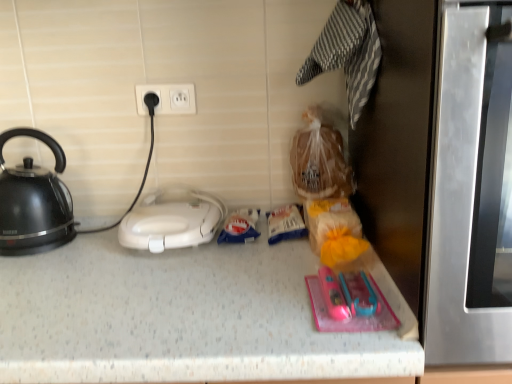
This screenshot has width=512, height=384. What do you see at coordinates (471, 189) in the screenshot?
I see `stainless steel oven at right` at bounding box center [471, 189].

The width and height of the screenshot is (512, 384). Identify the location of white plastic toaster at center. (170, 222).

Where is `black glossy kettle at left`? The image size is (512, 384). black glossy kettle at left is located at coordinates (34, 202).

The width and height of the screenshot is (512, 384). I want to click on stainless steel oven at right, so click(471, 189).

In the scene shown: Can you confirm if black glossy kettle at left is smaller than stainless steel oven at right?

Indeed, black glossy kettle at left has a smaller size compared to stainless steel oven at right.

Could you tell me if black glossy kettle at left is turned towards stainless steel oven at right?

No, black glossy kettle at left is not aimed at stainless steel oven at right.

Is white plastic electric outlet at upper center bigger than white plastic toaster at center?

No, white plastic electric outlet at upper center is not bigger than white plastic toaster at center.

Between white plastic electric outlet at upper center and white plastic toaster at center, which one is positioned in front?

white plastic toaster at center is in front.

Is white plastic electric outlet at upper center inside the boundaries of white plastic toaster at center, or outside?

white plastic electric outlet at upper center is outside white plastic toaster at center.

Considering the sizes of white plastic electric outlet at upper center and white plastic toaster at center in the image, is white plastic electric outlet at upper center taller or shorter than white plastic toaster at center?

In the image, white plastic electric outlet at upper center appears to be shorter than white plastic toaster at center.

Could you tell me if stainless steel oven at right is turned towards white plastic toaster at center?

No, stainless steel oven at right is not oriented towards white plastic toaster at center.

From the image's perspective, between stainless steel oven at right and white plastic toaster at center, which one is located above?

stainless steel oven at right.

How distant is black glossy kettle at left from white plastic electric outlet at upper center?

black glossy kettle at left and white plastic electric outlet at upper center are 13.00 inches apart.

Is point (28, 249) positioned behind point (190, 103)?

No, it is in front of (190, 103).

Would you say black glossy kettle at left is a long distance from white plastic electric outlet at upper center?

No, black glossy kettle at left is not far away from white plastic electric outlet at upper center.

Does black glossy kettle at left turn towards white plastic electric outlet at upper center?

No, black glossy kettle at left is not turned towards white plastic electric outlet at upper center.

Which object is positioned more to the right, white plastic electric outlet at upper center or stainless steel oven at right?

From the viewer's perspective, stainless steel oven at right appears more on the right side.

Find the location of `oven below the white plastic electric outlet at upper center (from the image's perspective)`. oven below the white plastic electric outlet at upper center (from the image's perspective) is located at coordinates (471, 189).

From the image's perspective, who appears lower, white plastic electric outlet at upper center or stainless steel oven at right?

stainless steel oven at right.

Considering the positions of point (463, 71) and point (188, 112), is point (463, 71) closer or farther from the camera than point (188, 112)?

Point (463, 71).

Is white plastic electric outlet at upper center located within stainless steel oven at right?

That's incorrect, white plastic electric outlet at upper center is not inside stainless steel oven at right.

From the image's perspective, would you say stainless steel oven at right is shown under white plastic electric outlet at upper center?

Correct, stainless steel oven at right appears lower than white plastic electric outlet at upper center in the image.

Is stainless steel oven at right facing towards white plastic electric outlet at upper center?

No, stainless steel oven at right does not turn towards white plastic electric outlet at upper center.

Which object is thinner, stainless steel oven at right or black glossy kettle at left?

black glossy kettle at left.

How different are the orientations of stainless steel oven at right and black glossy kettle at left in degrees?

The angle between the facing direction of stainless steel oven at right and the facing direction of black glossy kettle at left is 1.17e-05 degrees.

Where is `oven above the black glossy kettle at left (from the image's perspective)`? The width and height of the screenshot is (512, 384). oven above the black glossy kettle at left (from the image's perspective) is located at coordinates (471, 189).

From the image's perspective, which is below, stainless steel oven at right or black glossy kettle at left?

black glossy kettle at left.

This screenshot has height=384, width=512. In order to click on kettle below the stainless steel oven at right (from the image's perspective) in this screenshot , I will do `click(34, 202)`.

The image size is (512, 384). I want to click on home appliance in front of the white plastic electric outlet at upper center, so click(170, 222).

Which object lies nearer to the anchor point white plastic toaster at center, black glossy kettle at left or stainless steel oven at right?

black glossy kettle at left.

When comparing their distances from black glossy kettle at left, does white plastic toaster at center or stainless steel oven at right seem further?

The object further to black glossy kettle at left is stainless steel oven at right.

Looking at this image, looking at the image, which one is located further to white plastic electric outlet at upper center, black glossy kettle at left or stainless steel oven at right?

stainless steel oven at right lies further to white plastic electric outlet at upper center than the other object.

Which object lies further to the anchor point black glossy kettle at left, stainless steel oven at right or white plastic electric outlet at upper center?

stainless steel oven at right.

When comparing their distances from stainless steel oven at right, does black glossy kettle at left or white plastic toaster at center seem further?

Based on the image, black glossy kettle at left appears to be further to stainless steel oven at right.

Looking at the image, which one is located further to white plastic electric outlet at upper center, black glossy kettle at left or white plastic toaster at center?

The object further to white plastic electric outlet at upper center is black glossy kettle at left.

Looking at the image, which one is located further to black glossy kettle at left, white plastic electric outlet at upper center or white plastic toaster at center?

white plastic electric outlet at upper center is positioned further to the anchor black glossy kettle at left.

From the image, which object appears to be nearer to stainless steel oven at right, white plastic electric outlet at upper center or black glossy kettle at left?

The object closer to stainless steel oven at right is white plastic electric outlet at upper center.

Where is `home appliance located between white plastic electric outlet at upper center and stainless steel oven at right in the left-right direction`? This screenshot has width=512, height=384. home appliance located between white plastic electric outlet at upper center and stainless steel oven at right in the left-right direction is located at coordinates (170, 222).

Locate an element on the screen. This screenshot has height=384, width=512. home appliance situated between black glossy kettle at left and stainless steel oven at right from left to right is located at coordinates point(170,222).

Find the location of a particular element. Image resolution: width=512 pixels, height=384 pixels. electric outlet between black glossy kettle at left and white plastic toaster at center from left to right is located at coordinates (168, 99).

The image size is (512, 384). Identify the location of electric outlet between black glossy kettle at left and stainless steel oven at right from left to right. (168, 99).